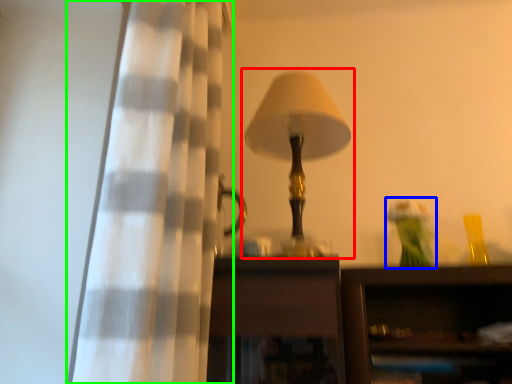
Question: Estimate the real-world distances between objects in this image. Which object is farther from lamp (highlighted by a red box), toy (highlighted by a blue box) or curtain (highlighted by a green box)?

Choices:
 (A) toy
 (B) curtain

Answer: (A)